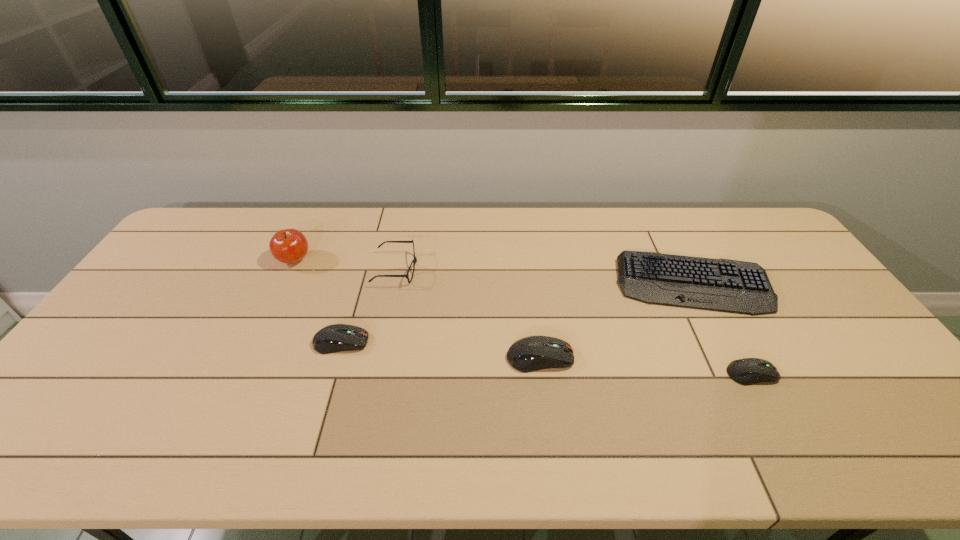
Please point a spot to add another computer equipment on the left. Please provide its 2D coordinates. Your answer should be formatted as a tuple, i.e. [(x, y)], where the tuple contains the x and y coordinates of a point satisfying the conditions above.

[(155, 328)]